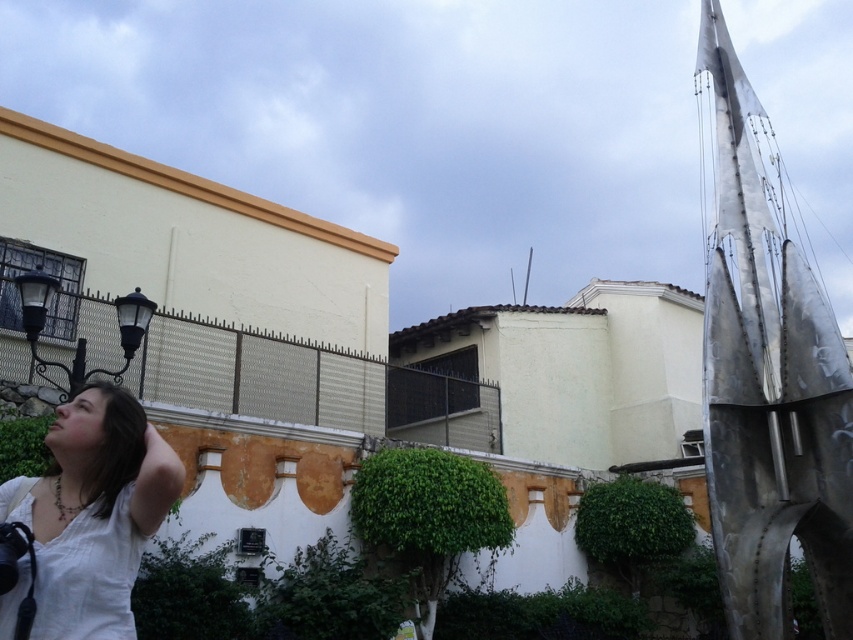
Question: Which object appears closest to the camera in this image?

Choices:
 (A) white cotton shirt at lower left
 (B) metallic silver sculpture at right

Answer: (A)

Question: Does metallic silver sculpture at right appear on the left side of white cotton shirt at lower left?

Choices:
 (A) yes
 (B) no

Answer: (B)

Question: Can you confirm if metallic silver sculpture at right is wider than white cotton shirt at lower left?

Choices:
 (A) yes
 (B) no

Answer: (A)

Question: Is metallic silver sculpture at right to the right of white cotton shirt at lower left from the viewer's perspective?

Choices:
 (A) no
 (B) yes

Answer: (B)

Question: Which point appears closest to the camera in this image?

Choices:
 (A) (1, 614)
 (B) (718, 532)

Answer: (A)